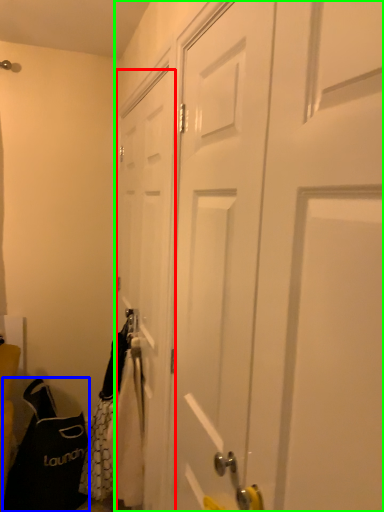
Question: Which object is positioned farthest from door (highlighted by a red box)? Select from shoulder bag (highlighted by a blue box) and door (highlighted by a green box).

Choices:
 (A) shoulder bag
 (B) door

Answer: (A)